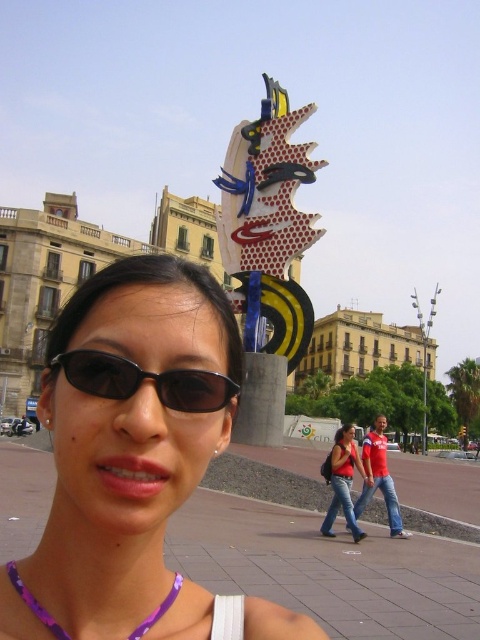
How much distance is there between matte black sunglasses at center and purple beaded necklace at lower center?

A distance of 16.61 feet exists between matte black sunglasses at center and purple beaded necklace at lower center.

Can you confirm if matte black sunglasses at center is thinner than purple beaded necklace at lower center?

No, matte black sunglasses at center is not thinner than purple beaded necklace at lower center.

Which is in front, point (199, 266) or point (165, 611)?

Point (165, 611)

The height and width of the screenshot is (640, 480). I want to click on matte black sunglasses at center, so click(x=132, y=460).

Looking at this image, can you confirm if red fabric shirt at center is bigger than purple beaded necklace at lower center?

Correct, red fabric shirt at center is larger in size than purple beaded necklace at lower center.

Which is more to the left, red fabric shirt at center or purple beaded necklace at lower center?

From the viewer's perspective, purple beaded necklace at lower center appears more on the left side.

Does point (382, 468) come behind point (14, 586)?

Yes, it is behind point (14, 586).

Find the location of a particular element. The image size is (480, 640). red fabric shirt at center is located at coordinates (379, 477).

Who is positioned more to the right, black matte sunglasses at center or matte red shirt at center?

matte red shirt at center

Between point (97, 365) and point (348, 445), which one is positioned in front?

Point (97, 365) is more forward.

Does point (69, 372) lie behind point (351, 448)?

No.

I want to click on black matte sunglasses at center, so (144, 380).